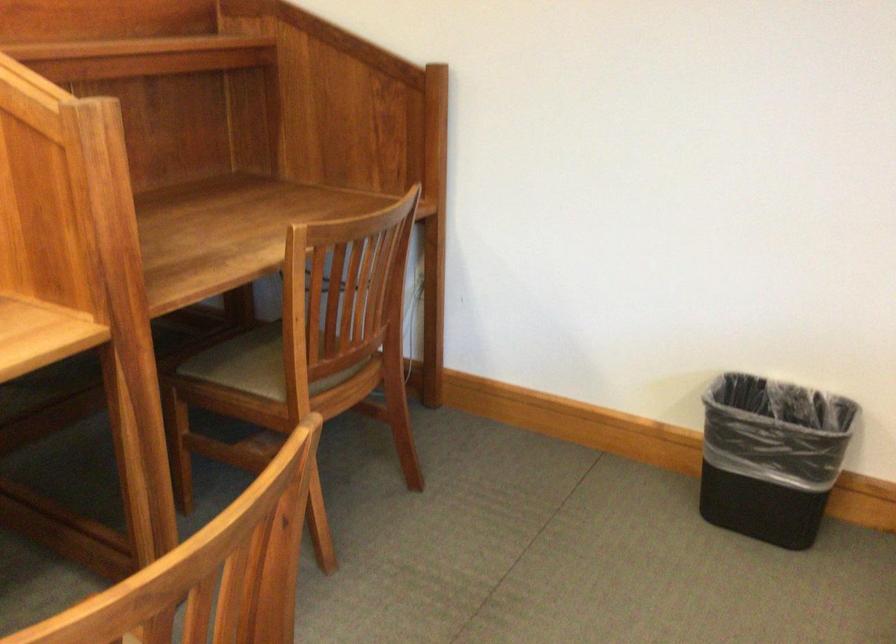
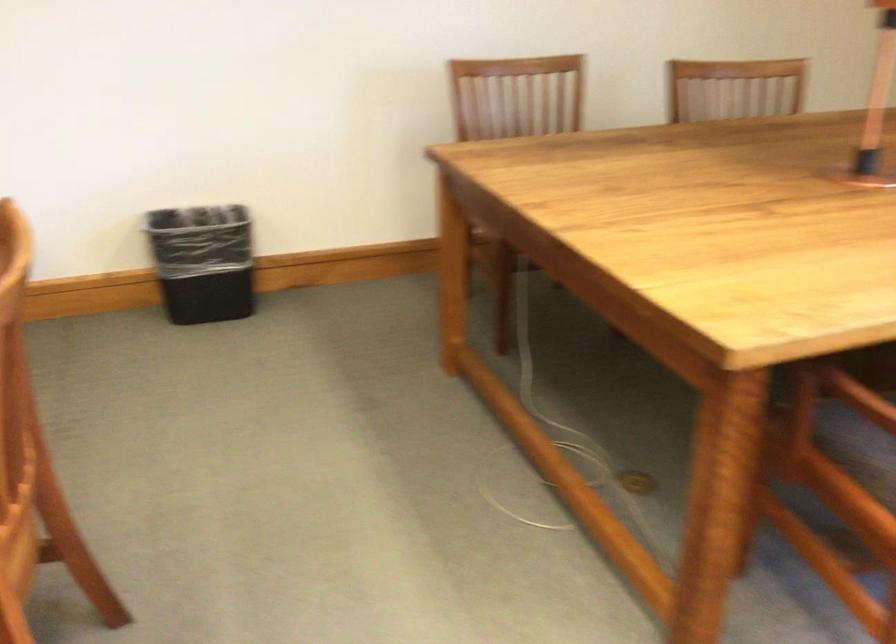
Where in the second image is the point corresponding to point (765, 458) from the first image?

(202, 261)